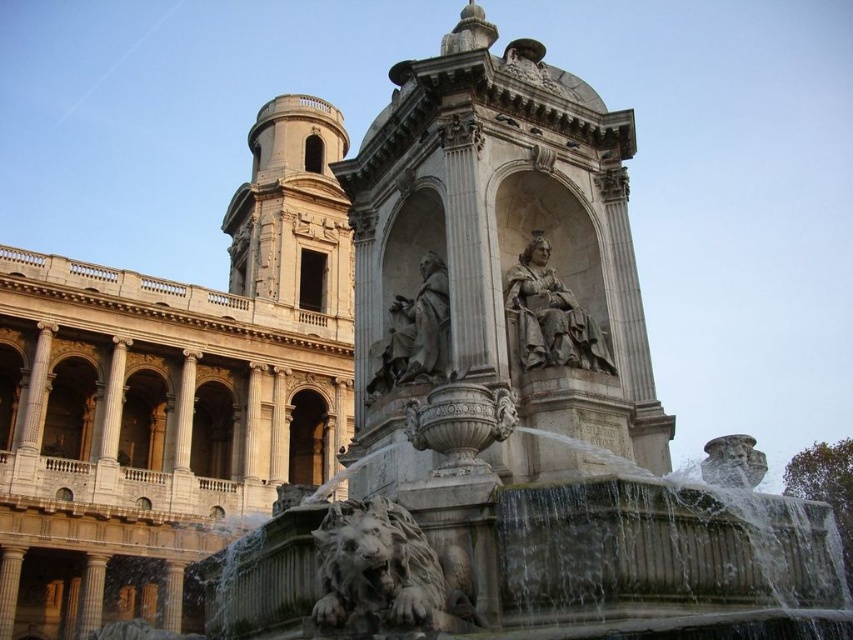
Is white marble statue at center positioned before polished stone statue at center?

Yes, white marble statue at center is closer to the viewer.

Is white marble statue at center smaller than polished stone statue at center?

No, white marble statue at center is not smaller than polished stone statue at center.

Which is behind, point (463, 268) or point (525, 362)?

Positioned behind is point (463, 268).

Where is `white marble statue at center`? The height and width of the screenshot is (640, 853). white marble statue at center is located at coordinates (502, 244).

Can you confirm if white marble statue at center is wider than gray stone statue at center?

Correct, the width of white marble statue at center exceeds that of gray stone statue at center.

Does white marble statue at center appear under gray stone statue at center?

Actually, white marble statue at center is above gray stone statue at center.

Is point (564, 77) positioned in front of point (380, 368)?

No, it is behind (380, 368).

The width and height of the screenshot is (853, 640). I want to click on white marble statue at center, so click(x=502, y=244).

Does polished stone statue at center have a smaller size compared to gray stone statue at center?

Incorrect, polished stone statue at center is not smaller in size than gray stone statue at center.

Can you confirm if polished stone statue at center is thinner than gray stone statue at center?

Incorrect, polished stone statue at center's width is not less than gray stone statue at center's.

Is point (608, 369) in front of point (438, 300)?

Yes, it is in front of point (438, 300).

In order to click on polished stone statue at center in this screenshot , I will do `click(550, 316)`.